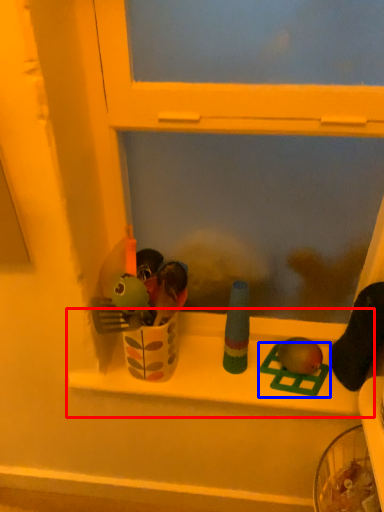
Question: Which object is further to the camera taking this photo, window sill (highlighted by a red box) or toy (highlighted by a blue box)?

Choices:
 (A) window sill
 (B) toy

Answer: (B)